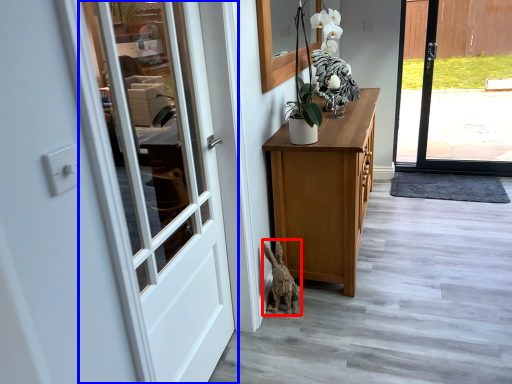
Question: Which of the following is the farthest to the observer, animal (highlighted by a red box) or door (highlighted by a blue box)?

Choices:
 (A) animal
 (B) door

Answer: (A)